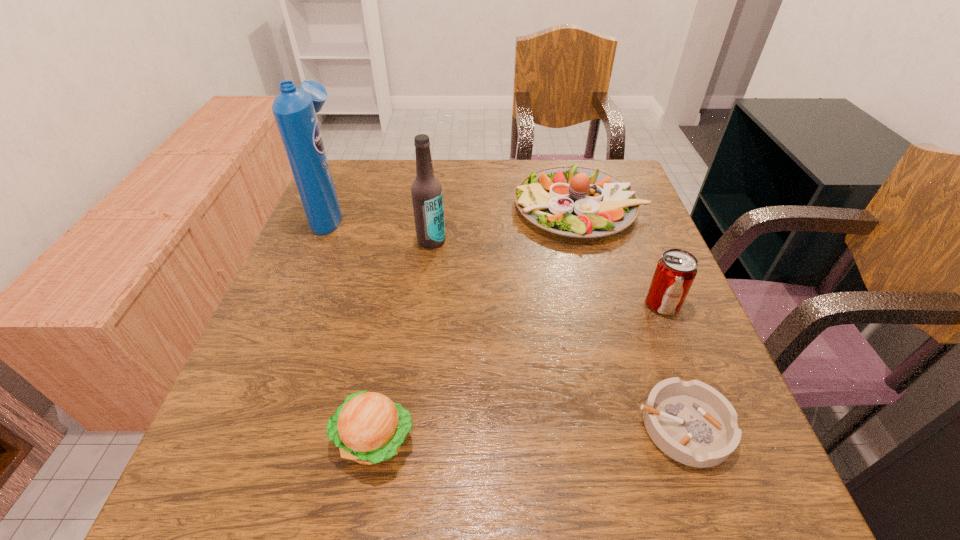
Where is `vacant space situated 0.230m on the front of the third tallest object`? This screenshot has height=540, width=960. vacant space situated 0.230m on the front of the third tallest object is located at coordinates click(710, 423).

Identify the location of vacant point located 0.360m on the left of the salad plate. Image resolution: width=960 pixels, height=540 pixels. (378, 207).

At what (x,y) coordinates should I click in order to perform the action: click on vacant space located 0.280m on the right of the hamburger. Please return your answer as a coordinate pair (x, y). Looking at the image, I should click on (590, 439).

Where is `free point located 0.220m on the back of the shortest object`? This screenshot has width=960, height=540. free point located 0.220m on the back of the shortest object is located at coordinates (638, 298).

Image resolution: width=960 pixels, height=540 pixels. Find the location of `shampoo that is at the far edge`. shampoo that is at the far edge is located at coordinates (294, 109).

Image resolution: width=960 pixels, height=540 pixels. I want to click on salad plate positioned at the far edge, so click(x=573, y=201).

This screenshot has height=540, width=960. Identify the location of hamburger situated at the near edge. (x=369, y=428).

Where is `ashtray present at the near edge`? The image size is (960, 540). ashtray present at the near edge is located at coordinates (691, 422).

This screenshot has width=960, height=540. In order to click on object present at the left edge in this screenshot , I will do `click(294, 109)`.

Where is `pop soda at the right edge`? This screenshot has width=960, height=540. pop soda at the right edge is located at coordinates (675, 271).